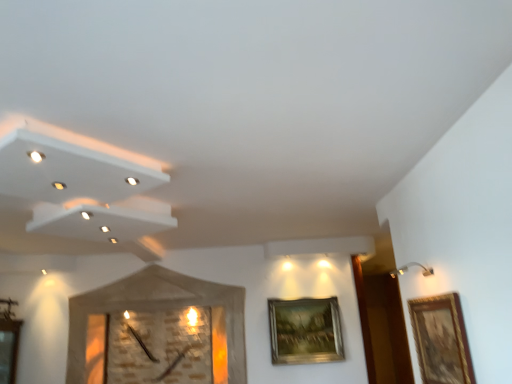
Question: Should I look upward or downward to see gold metallic picture frame at upper right, the 2th picture frame viewed from the right?

Choices:
 (A) up
 (B) down

Answer: (B)

Question: Does gold-framed painting at right, marked as the 1th picture frame in a front-to-back arrangement, appear on the right side of gold metallic picture frame at upper right, positioned as the 2th picture frame in top-to-bottom order?

Choices:
 (A) yes
 (B) no

Answer: (A)

Question: Does gold-framed painting at right, the second picture frame ordered from the bottom, contain gold metallic picture frame at upper right, the 2th picture frame viewed from the right?

Choices:
 (A) no
 (B) yes

Answer: (A)

Question: Is gold-framed painting at right, the second picture frame ordered from the bottom, outside gold metallic picture frame at upper right, the 2th picture frame viewed from the right?

Choices:
 (A) yes
 (B) no

Answer: (A)

Question: From the image's perspective, is gold-framed painting at right, marked as the 1th picture frame in a front-to-back arrangement, above gold metallic picture frame at upper right, positioned as the 2th picture frame in top-to-bottom order?

Choices:
 (A) yes
 (B) no

Answer: (A)

Question: Is gold-framed painting at right, the second picture frame from the back, next to gold metallic picture frame at upper right, the 1th picture frame from the left, and touching it?

Choices:
 (A) no
 (B) yes

Answer: (A)

Question: From the image's perspective, does gold-framed painting at right, the second picture frame from the back, appear lower than gold metallic picture frame at upper right, the 2th picture frame viewed from the right?

Choices:
 (A) no
 (B) yes

Answer: (A)

Question: Is gold-framed painting at right, the 1th picture frame positioned from the top, closer to the viewer compared to wooden textured clock at center?

Choices:
 (A) yes
 (B) no

Answer: (A)

Question: Is the depth of gold-framed painting at right, positioned as the 2th picture frame in left-to-right order, greater than that of wooden textured clock at center?

Choices:
 (A) yes
 (B) no

Answer: (B)

Question: Is gold-framed painting at right, the 1th picture frame from the right, to the right of wooden textured clock at center from the viewer's perspective?

Choices:
 (A) no
 (B) yes

Answer: (B)

Question: Is gold-framed painting at right, marked as the 1th picture frame in a front-to-back arrangement, bigger than wooden textured clock at center?

Choices:
 (A) yes
 (B) no

Answer: (B)

Question: Are gold-framed painting at right, the second picture frame ordered from the bottom, and wooden textured clock at center far apart?

Choices:
 (A) yes
 (B) no

Answer: (A)

Question: From the image's perspective, is gold-framed painting at right, the 1th picture frame positioned from the top, under wooden textured clock at center?

Choices:
 (A) no
 (B) yes

Answer: (A)

Question: From the image's perspective, is wooden textured clock at center beneath gold metallic picture frame at upper right, the 2th picture frame viewed from the right?

Choices:
 (A) yes
 (B) no

Answer: (B)